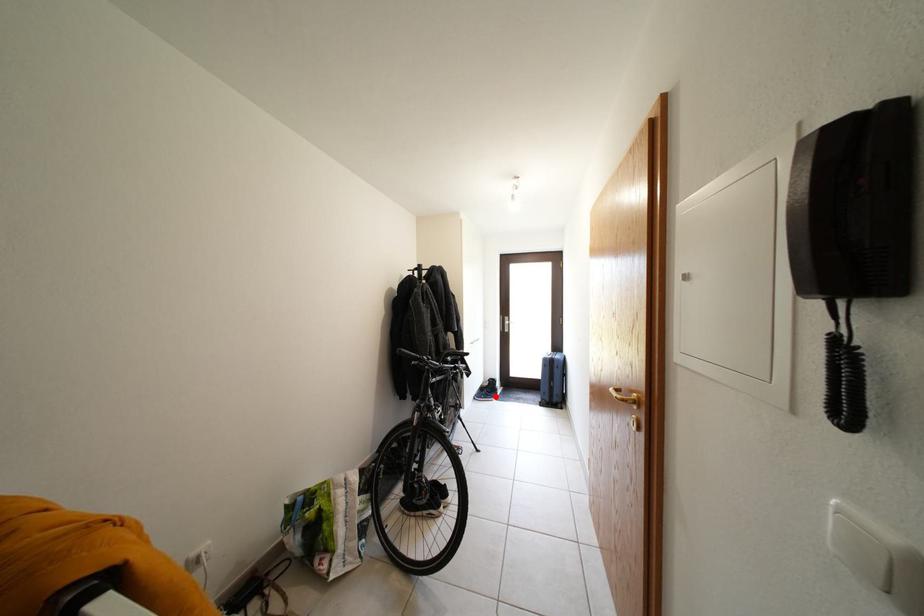
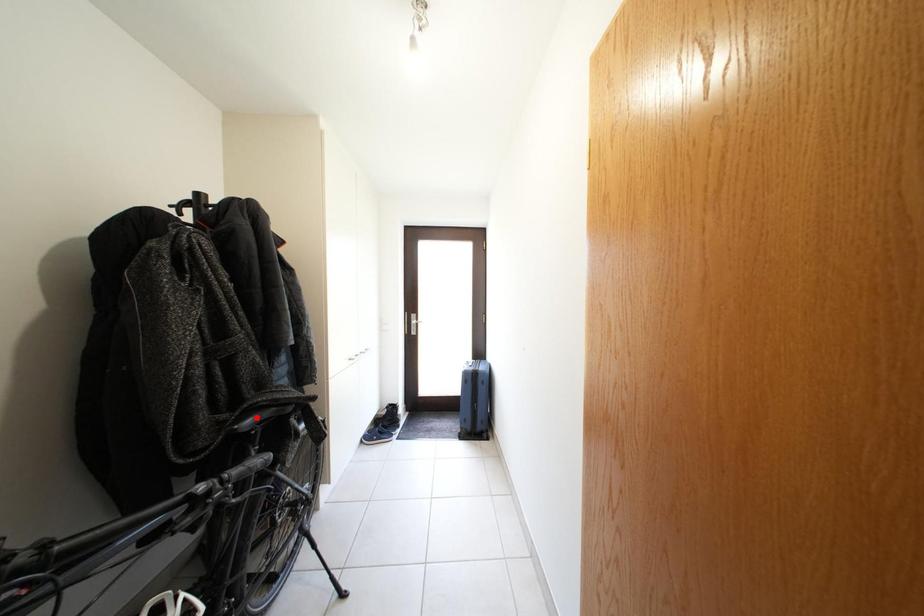
I am providing you with two images of the same scene from different viewpoints. A red point is marked on the first image and another point is marked on the second image. Is the marked point in image1 the same physical position as the marked point in image2?

No